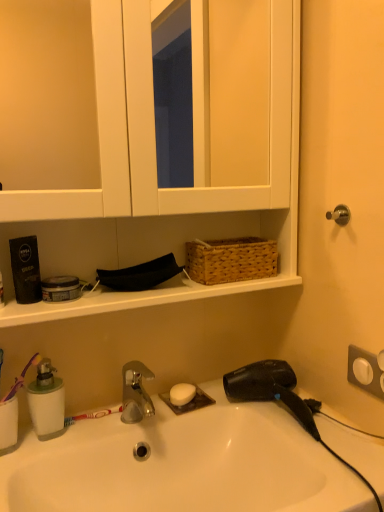
Question: In terms of height, does white matte soap at center look taller or shorter compared to white matte medicine cabinet at upper center?

Choices:
 (A) tall
 (B) short

Answer: (B)

Question: From the image's perspective, is white matte soap at center positioned above or below white matte medicine cabinet at upper center?

Choices:
 (A) above
 (B) below

Answer: (B)

Question: Which of these objects is positioned farthest from the black plastic hair dryer at lower right?

Choices:
 (A) purple plastic toothbrush at left
 (B) white glossy sink at lower center
 (C) green translucent soap dispenser at lower left
 (D) white matte medicine cabinet at upper center
 (E) woven brown basket at upper center

Answer: (D)

Question: Estimate the real-world distances between objects in this image. Which object is closer to the purple plastic toothbrush at left?

Choices:
 (A) white matte medicine cabinet at upper center
 (B) black plastic hair dryer at lower right
 (C) green translucent soap dispenser at lower left
 (D) white glossy sink at lower center
 (E) woven brown basket at upper center

Answer: (C)